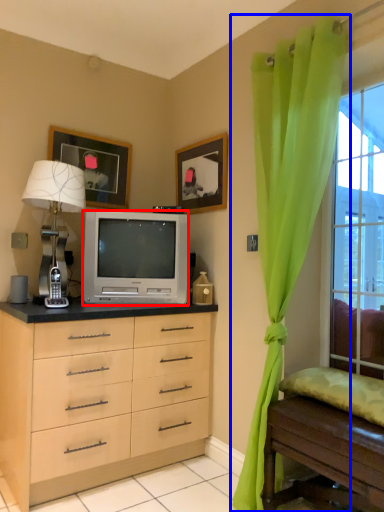
Question: Among these objects, which one is nearest to the camera, television (highlighted by a red box) or curtain (highlighted by a blue box)?

Choices:
 (A) television
 (B) curtain

Answer: (B)